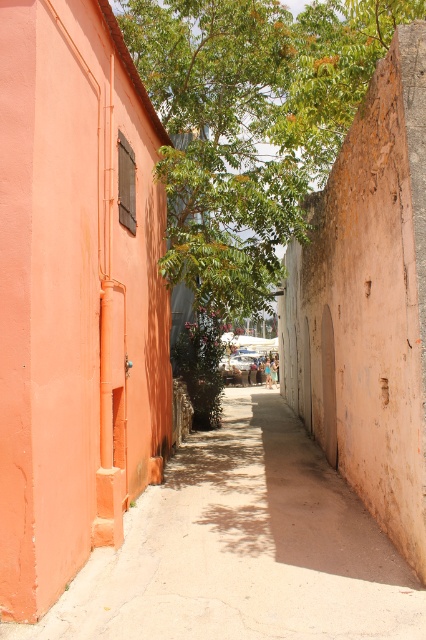
Which is below, smooth concrete path at center or green leafy tree at upper center?

smooth concrete path at center is below.

Does smooth concrete path at center have a greater width compared to green leafy tree at upper center?

Yes.

Is point (336, 579) farther from camera compared to point (247, 60)?

No, (336, 579) is closer to viewer.

Where is `smooth concrete path at center`? The height and width of the screenshot is (640, 426). smooth concrete path at center is located at coordinates (241, 547).